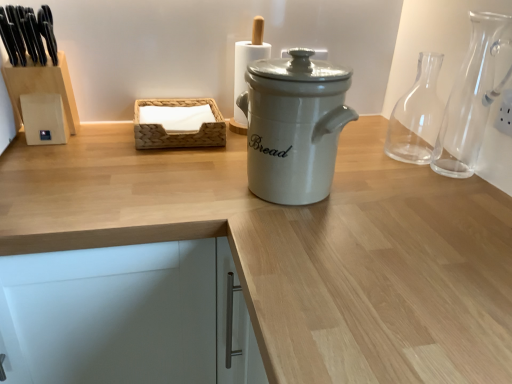
Question: In the image, is white ceramic bread bin at center on the left side or the right side of white matte cabinet at lower left?

Choices:
 (A) right
 (B) left

Answer: (A)

Question: In terms of size, does white ceramic bread bin at center appear bigger or smaller than white matte cabinet at lower left?

Choices:
 (A) small
 (B) big

Answer: (A)

Question: Which object is the farthest from the white ceramic bread bin at center?

Choices:
 (A) white matte cabinet at lower left
 (B) transparent glass carafe at right, the 1th glass vase when ordered from back to front
 (C) transparent glass carafe at right, positioned as the 2th glass vase in back-to-front order
 (D) woven wood tissue box at center
 (E) white plastic electric outlet at upper right

Answer: (E)

Question: Considering the real-world distances, which object is farthest from the white ceramic bread bin at center?

Choices:
 (A) transparent glass carafe at right, the 1th glass vase when ordered from back to front
 (B) transparent glass carafe at right, the 1th glass vase in the front-to-back sequence
 (C) white matte cabinet at lower left
 (D) white plastic electric outlet at upper right
 (E) woven wood tissue box at center

Answer: (D)